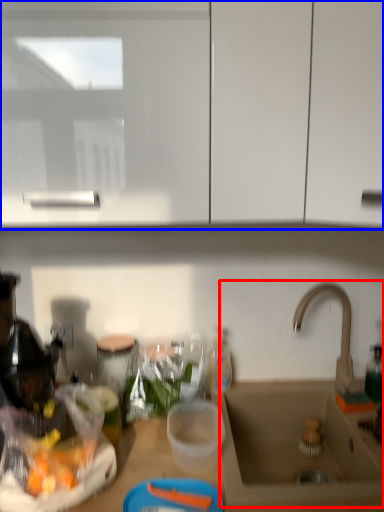
Question: Which object appears farthest to the camera in this image, sink (highlighted by a red box) or cabinetry (highlighted by a blue box)?

Choices:
 (A) sink
 (B) cabinetry

Answer: (A)